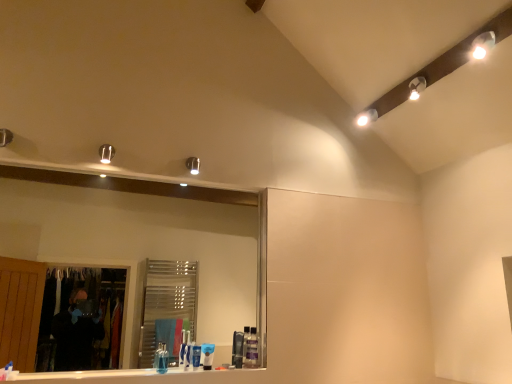
Question: Is white glossy light fixture at upper right positioned beyond the bounds of translucent plastic soap dispenser at center, positioned as the 3th toiletry in left-to-right order?

Choices:
 (A) yes
 (B) no

Answer: (A)

Question: Can you confirm if white glossy light fixture at upper right is smaller than translucent plastic soap dispenser at center, acting as the 2th toiletry starting from the right?

Choices:
 (A) no
 (B) yes

Answer: (A)

Question: Is white glossy light fixture at upper right behind translucent plastic soap dispenser at center, acting as the 2th toiletry starting from the right?

Choices:
 (A) yes
 (B) no

Answer: (A)

Question: Is white glossy light fixture at upper right at the right side of translucent plastic soap dispenser at center, positioned as the 3th toiletry in left-to-right order?

Choices:
 (A) yes
 (B) no

Answer: (A)

Question: From a real-world perspective, is white glossy light fixture at upper right on top of translucent plastic soap dispenser at center, positioned as the 3th toiletry in left-to-right order?

Choices:
 (A) no
 (B) yes

Answer: (B)

Question: Does white glossy light fixture at upper right come in front of translucent plastic soap dispenser at center, positioned as the 3th toiletry in left-to-right order?

Choices:
 (A) yes
 (B) no

Answer: (B)

Question: Is white glossy toothpaste at lower center, which ranks as the 1th toothpaste in right-to-left order, wider than white glossy light fixture at upper right?

Choices:
 (A) yes
 (B) no

Answer: (B)

Question: Could you tell me if white glossy toothpaste at lower center, arranged as the second toothpaste when viewed from the left, is turned towards white glossy light fixture at upper right?

Choices:
 (A) no
 (B) yes

Answer: (A)

Question: Is white glossy toothpaste at lower center, the 2th toothpaste when ordered from front to back, bigger than white glossy light fixture at upper right?

Choices:
 (A) no
 (B) yes

Answer: (A)

Question: Considering the relative sizes of white glossy toothpaste at lower center, the 1th toothpaste positioned from the back, and white glossy light fixture at upper right in the image provided, is white glossy toothpaste at lower center, the 1th toothpaste positioned from the back, thinner than white glossy light fixture at upper right?

Choices:
 (A) yes
 (B) no

Answer: (A)

Question: Can you confirm if white glossy toothpaste at lower center, the 2th toothpaste when ordered from front to back, is smaller than white glossy light fixture at upper right?

Choices:
 (A) no
 (B) yes

Answer: (B)

Question: Is white glossy toothpaste at lower center, arranged as the second toothpaste when viewed from the left, shorter than white glossy light fixture at upper right?

Choices:
 (A) no
 (B) yes

Answer: (A)

Question: Does blue matte toothpaste at center, the second toiletry from the left, have a lesser height compared to white glossy toothpaste at lower center, the 2th toothpaste when ordered from front to back?

Choices:
 (A) no
 (B) yes

Answer: (A)